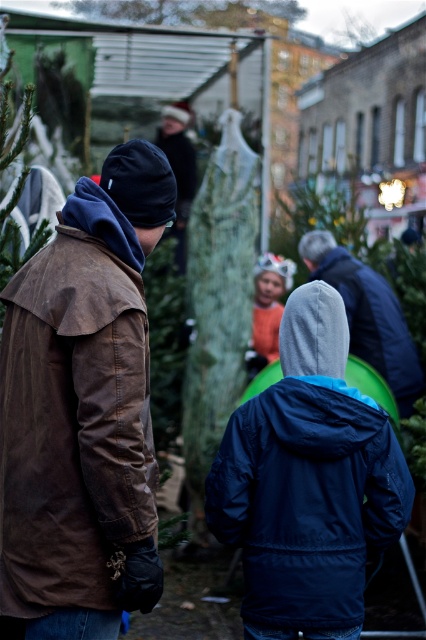
Question: Can you confirm if blue fabric jacket at center is smaller than green textured christmas tree at center?

Choices:
 (A) no
 (B) yes

Answer: (B)

Question: Estimate the real-world distances between objects in this image. Which object is farther from the blue fabric jacket at center?

Choices:
 (A) brown waxed leather jacket at left
 (B) green matte christmas tree at upper center

Answer: (B)

Question: Which is nearer to the green matte christmas tree at upper center?

Choices:
 (A) brown waxed leather jacket at left
 (B) green textured christmas tree at center
 (C) orange fuzzy hat at center
 (D) blue fabric jacket at center

Answer: (B)

Question: Is green textured christmas tree at center smaller than green matte christmas tree at upper center?

Choices:
 (A) yes
 (B) no

Answer: (A)

Question: Which of the following is the farthest from the observer?

Choices:
 (A) brown waxed leather jacket at left
 (B) blue fabric jacket at center
 (C) orange fuzzy hat at center

Answer: (C)

Question: Is the position of brown waxed leather jacket at left more distant than that of green textured christmas tree at center?

Choices:
 (A) yes
 (B) no

Answer: (B)